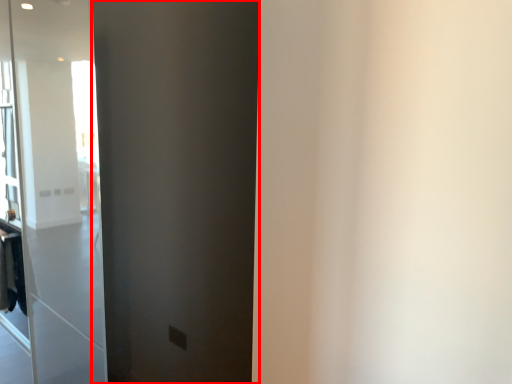
Question: From the image's perspective, considering the relative positions of barn door (annotated by the red box) and laundry in the image provided, where is barn door (annotated by the red box) located with respect to the staircase?

Choices:
 (A) below
 (B) above

Answer: (B)